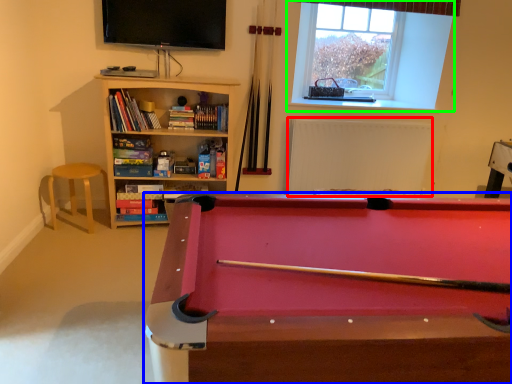
Question: Considering the real-world distances, which object is farthest from radiator (highlighted by a red box)? billiard table (highlighted by a blue box) or window (highlighted by a green box)?

Choices:
 (A) billiard table
 (B) window

Answer: (A)